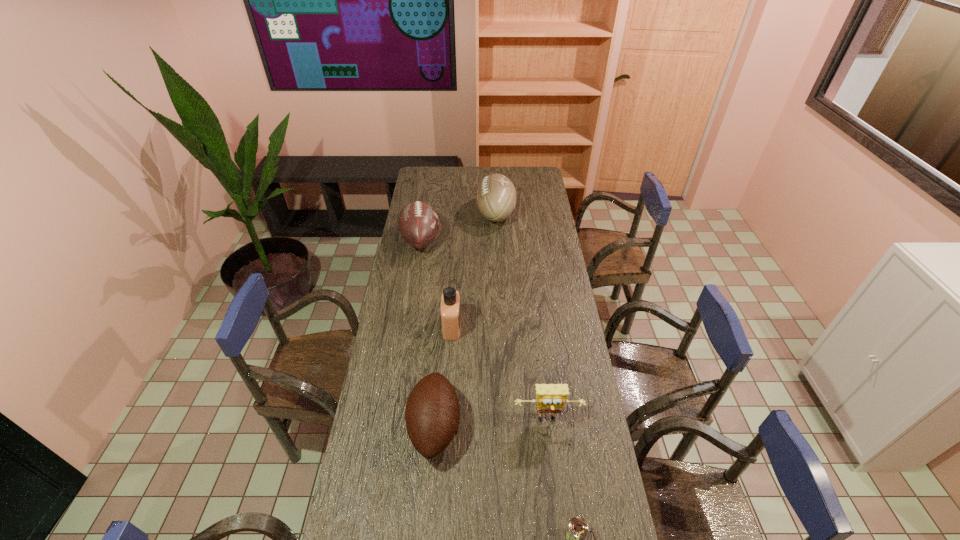
The image size is (960, 540). Identify the location of the rightmost football. (496, 196).

Locate an element on the screen. perfume is located at coordinates (450, 302).

Identify the location of the nearest football. The height and width of the screenshot is (540, 960). (432, 413).

The width and height of the screenshot is (960, 540). I want to click on sponge, so click(550, 398).

Where is `vacant space located on the laces of the rightmost football`? The image size is (960, 540). vacant space located on the laces of the rightmost football is located at coordinates (443, 214).

Where is `vacant space located on the laces of the rightmost football`? The image size is (960, 540). vacant space located on the laces of the rightmost football is located at coordinates (456, 214).

Where is `vacant space located on the laces of the rightmost football`? The image size is (960, 540). vacant space located on the laces of the rightmost football is located at coordinates (446, 214).

The width and height of the screenshot is (960, 540). Find the location of `free space located 0.250m on the front label of the third farthest object`. free space located 0.250m on the front label of the third farthest object is located at coordinates (521, 327).

The width and height of the screenshot is (960, 540). In order to click on vacant point located on the laces of the nearest football in this screenshot , I will do `click(493, 427)`.

The width and height of the screenshot is (960, 540). Identify the location of vacant space located on the face of the sponge. [556, 488].